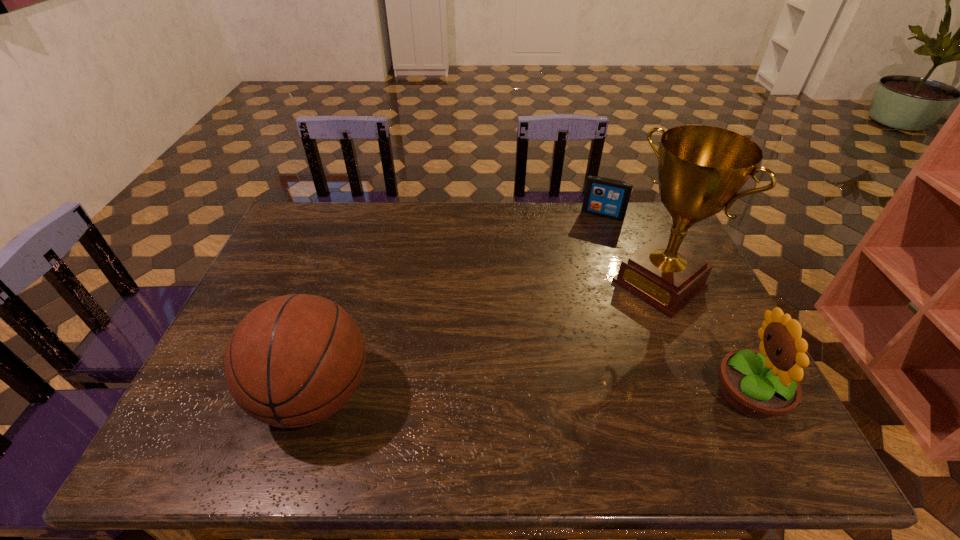
The image size is (960, 540). What are the coordinates of `free space on the desktop that is between the basketball and the sunflower and is positioned on the front screen of the iPod` in the screenshot? It's located at (528, 395).

Identify the location of vacant space on the desktop that is between the leftmost object and the sunflower and is positioned on the plaque of the award. 516,395.